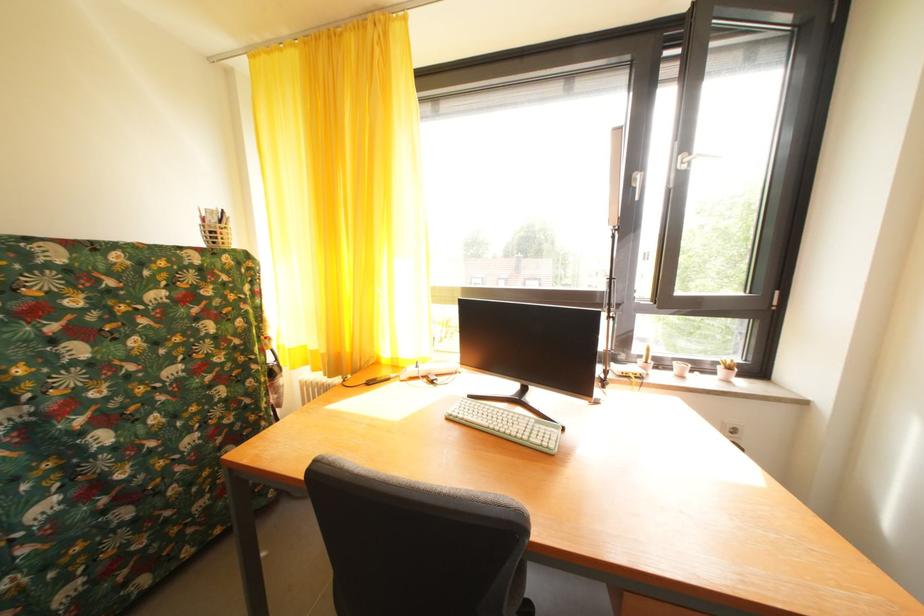
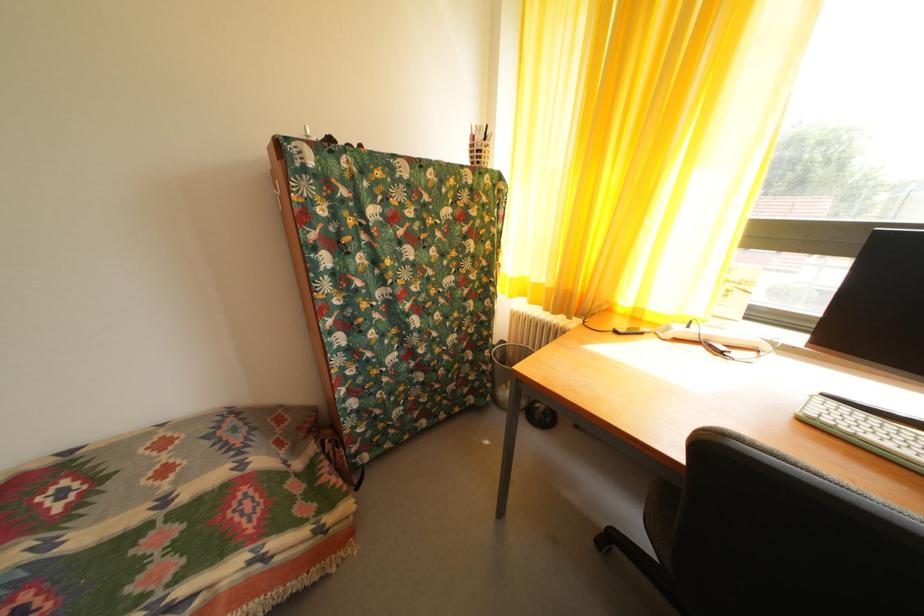
Question: How did the camera likely rotate?

Choices:
 (A) Left
 (B) Right
 (C) Up
 (D) Down

Answer: (A)